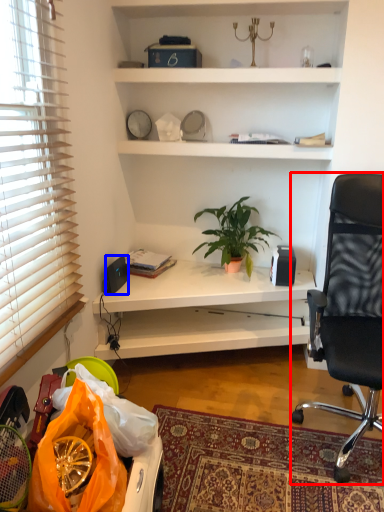
Question: Among these objects, which one is farthest to the camera, chair (highlighted by a red box) or loudspeaker (highlighted by a blue box)?

Choices:
 (A) chair
 (B) loudspeaker

Answer: (B)